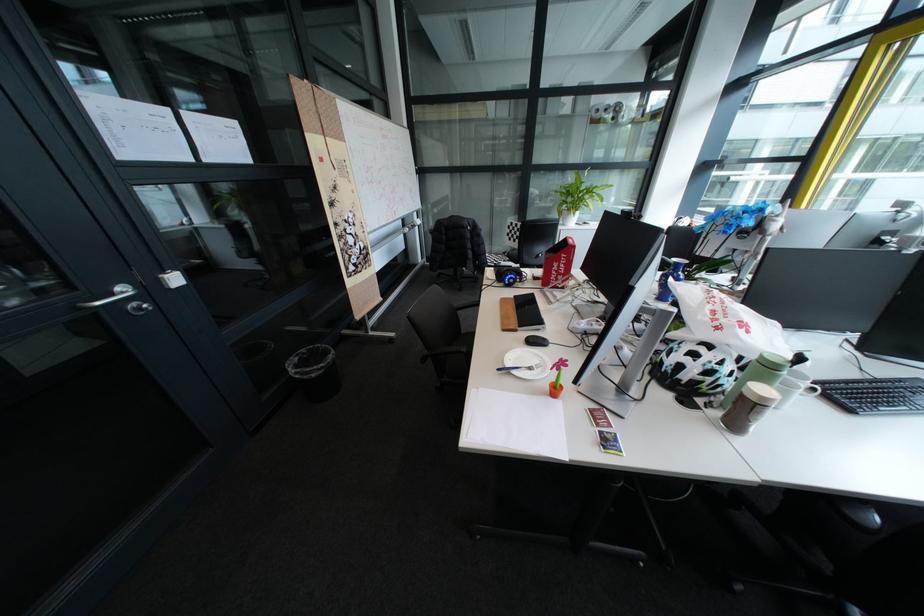
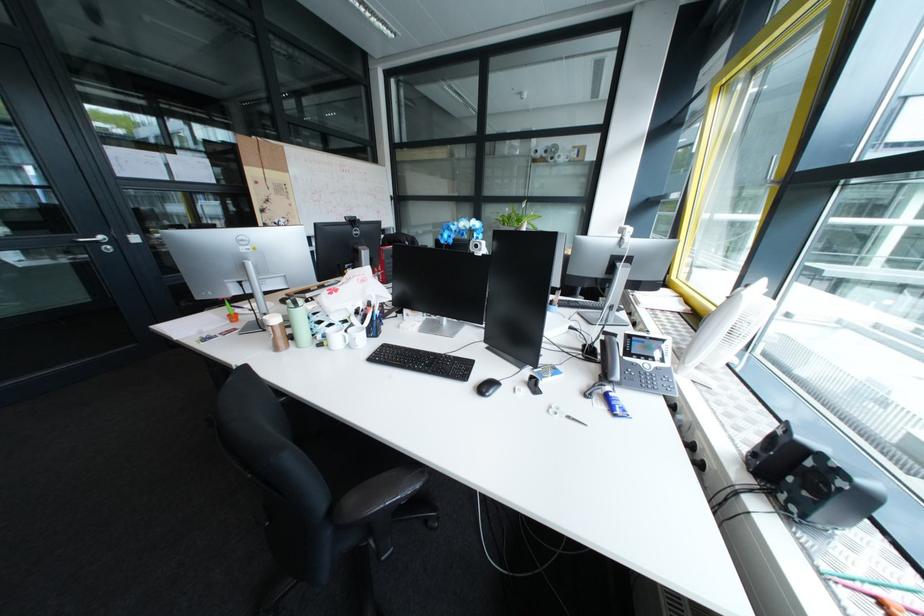
Question: Which direction would the cameraman need to move to produce the second image? Reply with the corresponding letter.

Choices:
 (A) Left
 (B) Right
 (C) Forward
 (D) Backward

Answer: (B)